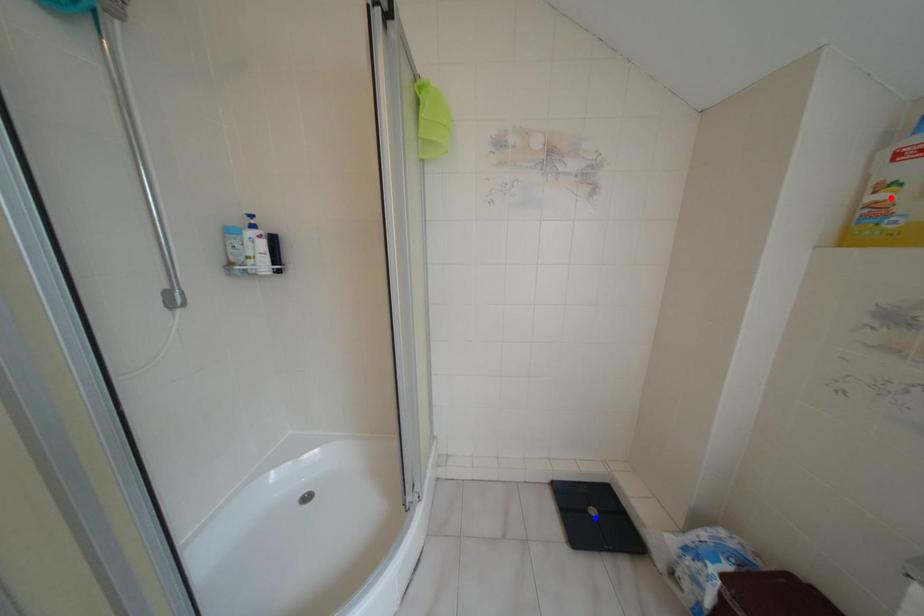
Question: Two points are marked on the image. Which point is closer to the camera?

Choices:
 (A) Blue point is closer.
 (B) Red point is closer.

Answer: (B)